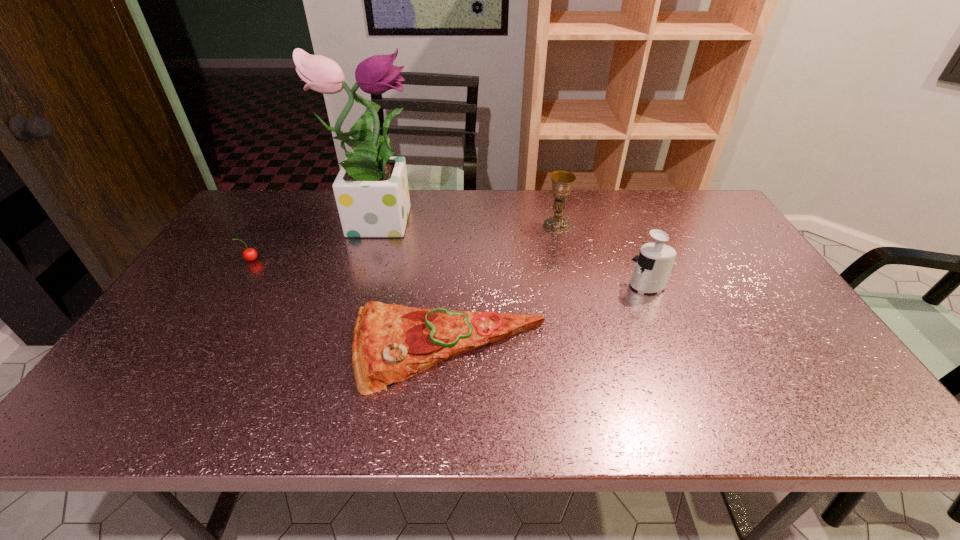
The height and width of the screenshot is (540, 960). I want to click on free area in between the second nearest object and the leftmost object, so click(449, 273).

Locate an element on the screen. vacant area that lies between the flower arrangement and the nearest object is located at coordinates (413, 285).

Locate which object is the fourth closest to the second shortest object. Please provide its 2D coordinates. Your answer should be formatted as a tuple, i.e. [(x, y)], where the tuple contains the x and y coordinates of a point satisfying the conditions above.

[(653, 266)]

At what (x,y) coordinates should I click in order to perform the action: click on object that can be found as the closest to the pizza. Please return your answer as a coordinate pair (x, y). This screenshot has width=960, height=540. Looking at the image, I should click on (653, 266).

Where is `blank space that satisfies the following two spatial constraints: 1. on the front-facing side of the tallest object; 2. on the left side of the nearest object`? This screenshot has height=540, width=960. blank space that satisfies the following two spatial constraints: 1. on the front-facing side of the tallest object; 2. on the left side of the nearest object is located at coordinates (335, 350).

This screenshot has height=540, width=960. Find the location of `vacant point that satisfies the following two spatial constraints: 1. on the back side of the second object from right to left; 2. on the right side of the cherry`. vacant point that satisfies the following two spatial constraints: 1. on the back side of the second object from right to left; 2. on the right side of the cherry is located at coordinates (273, 225).

Find the location of a particular element. This screenshot has width=960, height=540. free space that satisfies the following two spatial constraints: 1. on the front-facing side of the chalice; 2. on the right side of the flower arrangement is located at coordinates (374, 225).